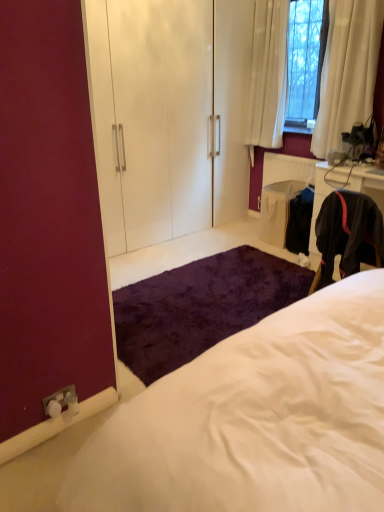
Question: Is white fluffy bed at center not within shaggy purple rug at lower center?

Choices:
 (A) no
 (B) yes

Answer: (B)

Question: Is white fluffy bed at center behind shaggy purple rug at lower center?

Choices:
 (A) no
 (B) yes

Answer: (A)

Question: Can you confirm if white fluffy bed at center is taller than shaggy purple rug at lower center?

Choices:
 (A) yes
 (B) no

Answer: (A)

Question: Considering the relative sizes of white fluffy bed at center and shaggy purple rug at lower center in the image provided, is white fluffy bed at center shorter than shaggy purple rug at lower center?

Choices:
 (A) no
 (B) yes

Answer: (A)

Question: Is white fluffy bed at center oriented away from shaggy purple rug at lower center?

Choices:
 (A) no
 (B) yes

Answer: (A)

Question: Is the surface of white fluffy bed at center in direct contact with shaggy purple rug at lower center?

Choices:
 (A) no
 (B) yes

Answer: (A)

Question: Can you confirm if white glossy armoire at upper center is taller than white textured radiator at right?

Choices:
 (A) yes
 (B) no

Answer: (A)

Question: Can you confirm if white glossy armoire at upper center is positioned to the left of white textured radiator at right?

Choices:
 (A) no
 (B) yes

Answer: (B)

Question: Does white glossy armoire at upper center turn towards white textured radiator at right?

Choices:
 (A) yes
 (B) no

Answer: (A)

Question: Is white glossy armoire at upper center not within white textured radiator at right?

Choices:
 (A) no
 (B) yes

Answer: (B)

Question: Considering the relative sizes of white glossy armoire at upper center and white textured radiator at right in the image provided, is white glossy armoire at upper center smaller than white textured radiator at right?

Choices:
 (A) yes
 (B) no

Answer: (B)

Question: Does white glossy armoire at upper center contain white textured radiator at right?

Choices:
 (A) yes
 (B) no

Answer: (B)

Question: Does white glossy armoire at upper center have a lesser width compared to shaggy purple rug at lower center?

Choices:
 (A) yes
 (B) no

Answer: (A)